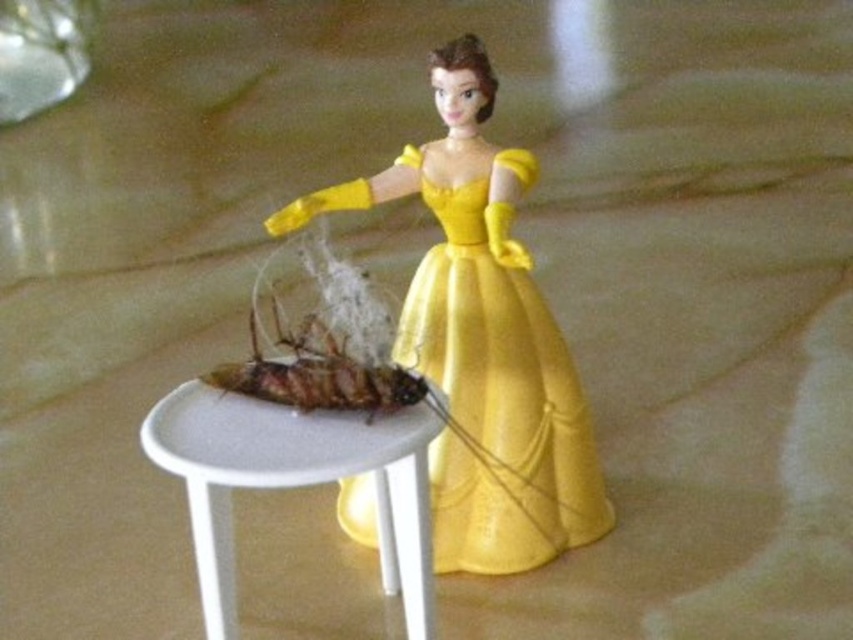
Question: Does yellow satin dress at center appear on the left side of white plastic table at center?

Choices:
 (A) yes
 (B) no

Answer: (B)

Question: Which of the following is the farthest from the observer?

Choices:
 (A) (412, 589)
 (B) (352, 508)

Answer: (B)

Question: Among these points, which one is farthest from the camera?

Choices:
 (A) (201, 380)
 (B) (428, 353)

Answer: (B)

Question: Is yellow satin dress at center thinner than white plastic table at center?

Choices:
 (A) yes
 (B) no

Answer: (B)

Question: Can you confirm if yellow satin dress at center is smaller than white plastic table at center?

Choices:
 (A) no
 (B) yes

Answer: (A)

Question: Which point is closer to the camera?

Choices:
 (A) (583, 499)
 (B) (326, 412)

Answer: (B)